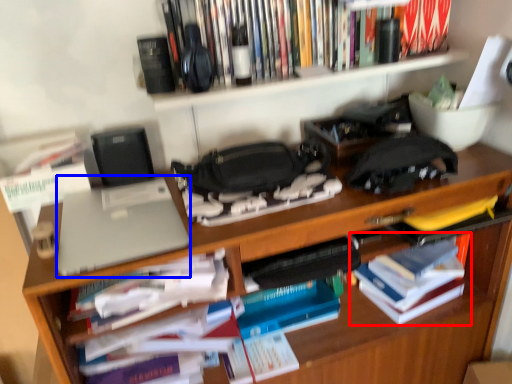
Question: Which object appears farthest to the camera in this image, book (highlighted by a red box) or laptop (highlighted by a blue box)?

Choices:
 (A) book
 (B) laptop

Answer: (A)